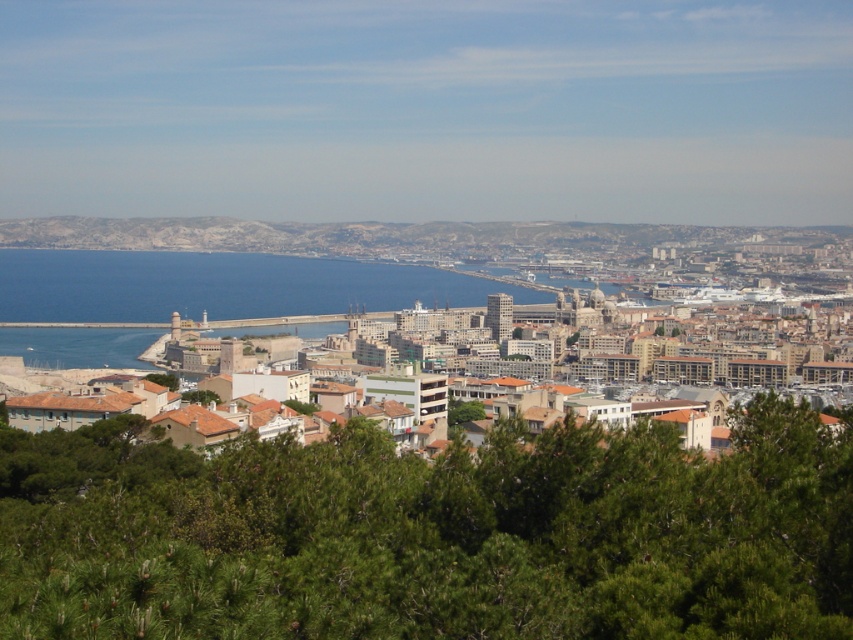
You are a tourist standing at the edge of the harbor in Marseille, France. You see the brown stone buildings at center and the blue water at center. Which one appears taller from your vantage point?

The brown stone buildings at center appear taller than the blue water at center from your vantage point.

You are standing at the edge of the harbor looking towards the city. You see the green leafy tree at lower center and the brown stone buildings at center. Which object is nearer to you?

The green leafy tree at lower center is closer to the viewer than the brown stone buildings at center.

You are a tourist standing at the harbor looking towards the city. You see the brown stone buildings at center and the blue water at center. Which one is higher in your view?

The brown stone buildings at center are located above the blue water at center in the view.